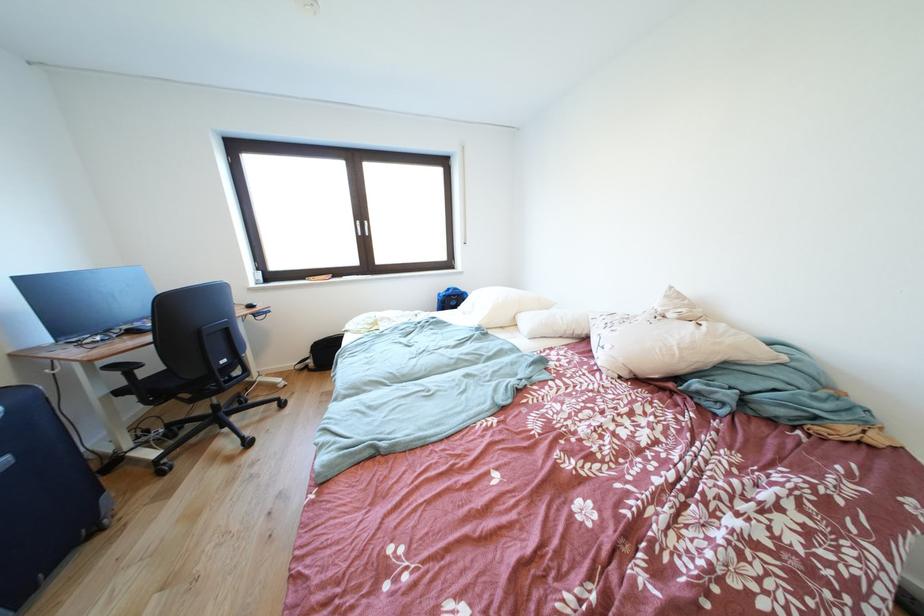
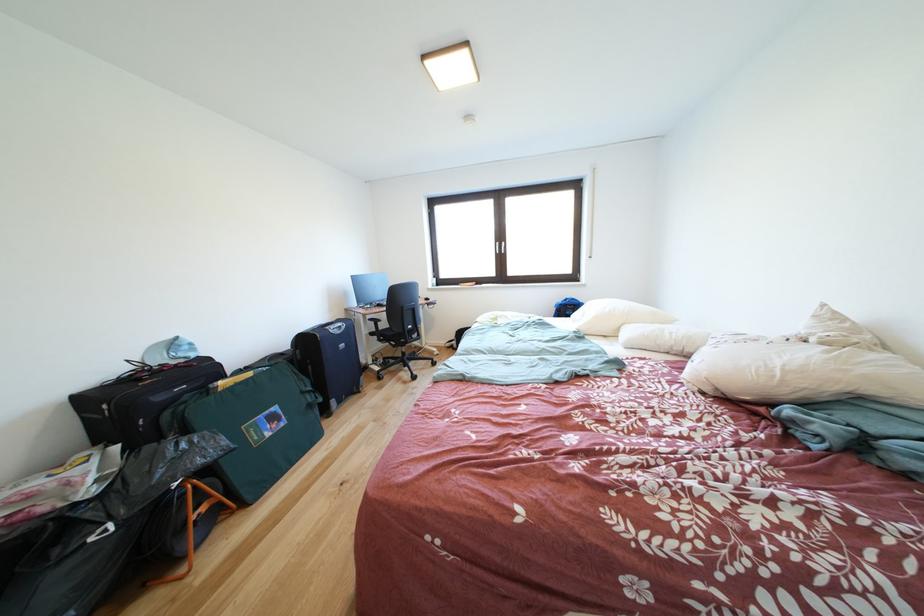
The point at [367,228] is marked in the first image. Where is the corresponding point in the second image?

(505, 249)